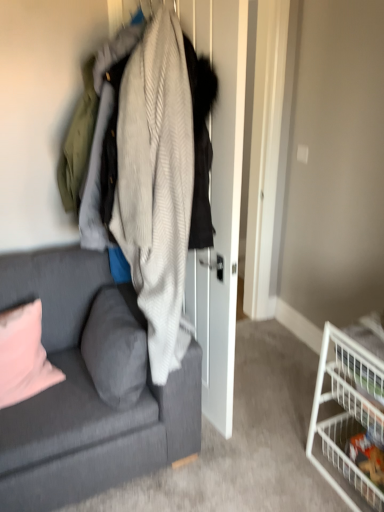
Question: Looking at their shapes, would you say gray fabric pillow at lower left, which appears as the first pillow when viewed from the right, is wider or thinner than textured gray couch at left?

Choices:
 (A) thin
 (B) wide

Answer: (A)

Question: From a real-world perspective, relative to textured gray couch at left, is gray fabric pillow at lower left, which appears as the first pillow when viewed from the right, vertically above or below?

Choices:
 (A) above
 (B) below

Answer: (A)

Question: Which object is positioned closest to the gray fabric pillow at lower left, which appears as the first pillow when viewed from the right?

Choices:
 (A) textured gray couch at left
 (B) pink fabric pillow at lower left, arranged as the 1th pillow when viewed from the left
 (C) knitted wool sweater at center
 (D) white wire basket at lower right, the first shelf viewed from the top
 (E) white wire basket at lower right, which is counted as the 2th shelf, starting from the top

Answer: (A)

Question: Based on their relative distances, which object is farther from the white wire basket at lower right, the first shelf in the bottom-to-top sequence?

Choices:
 (A) pink fabric pillow at lower left, the second pillow from the right
 (B) knitted wool sweater at center
 (C) gray fabric pillow at lower left, which appears as the first pillow when viewed from the right
 (D) textured gray couch at left
 (E) white wire basket at lower right, the first shelf viewed from the top

Answer: (A)